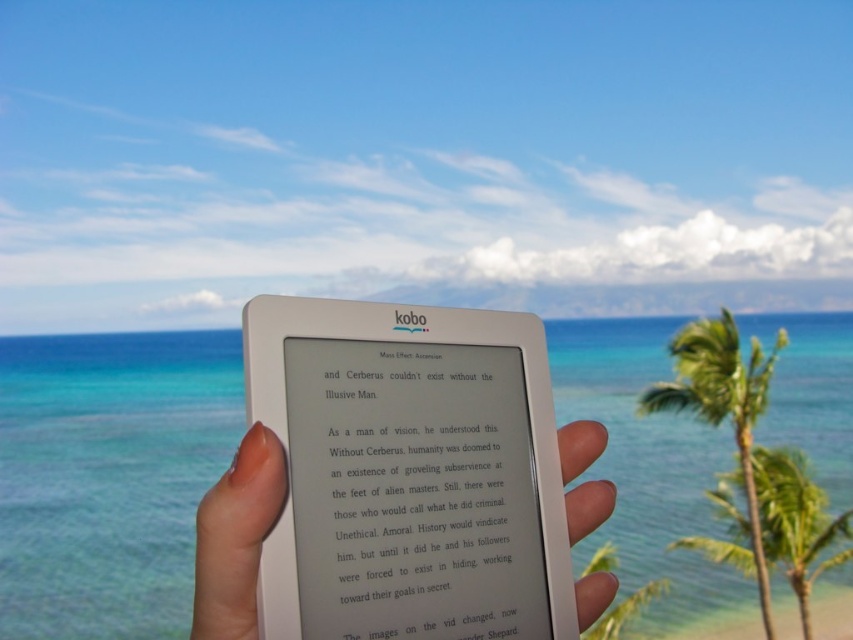
Is smooth skin hand at center wider than green leafy palm tree at right?

Incorrect, smooth skin hand at center's width does not surpass green leafy palm tree at right's.

Which is in front, point (247, 454) or point (697, 339)?

Point (247, 454) is more forward.

At what (x,y) coordinates should I click in order to perform the action: click on smooth skin hand at center. Please return your answer as a coordinate pair (x, y). Looking at the image, I should click on (236, 538).